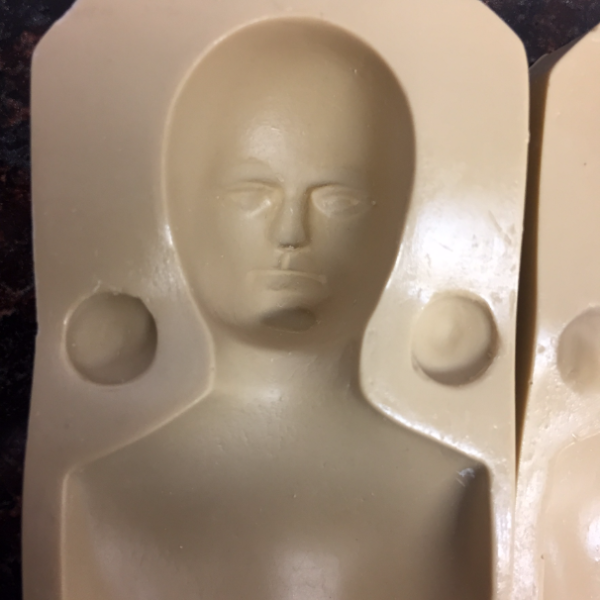
Locate an element on the screen. sculpture is located at coordinates 413,415.